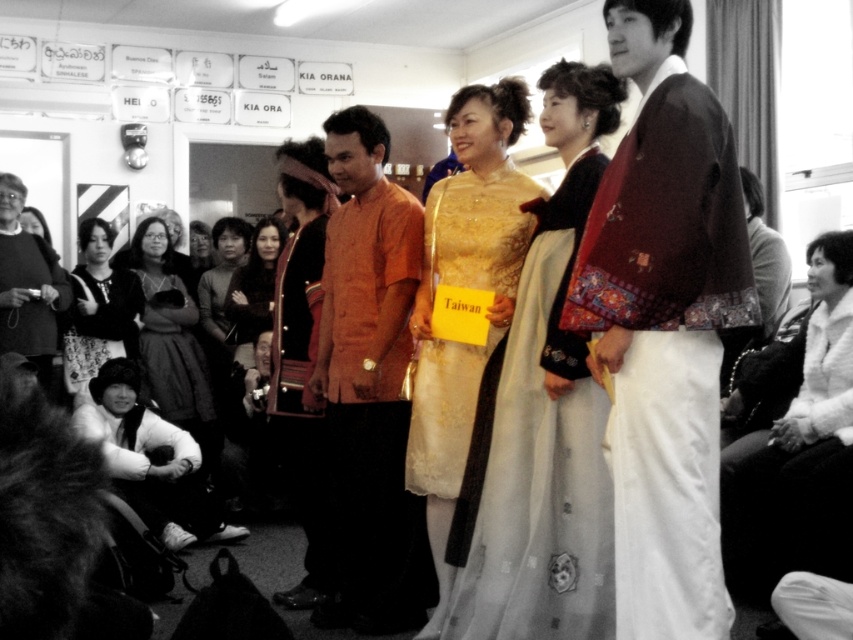
You are a photographer trying to capture the matte brown kimono at center and the fluffy black hat at lower left in the same frame. Based on their positions, which object is closer to the camera?

The matte brown kimono at center is closer to the camera because it is in front of the fluffy black hat at lower left.

Based on the scene description, where is the orange matte shirt at center located in terms of coordinates?

The orange matte shirt at center is located at coordinates point (368, 385).